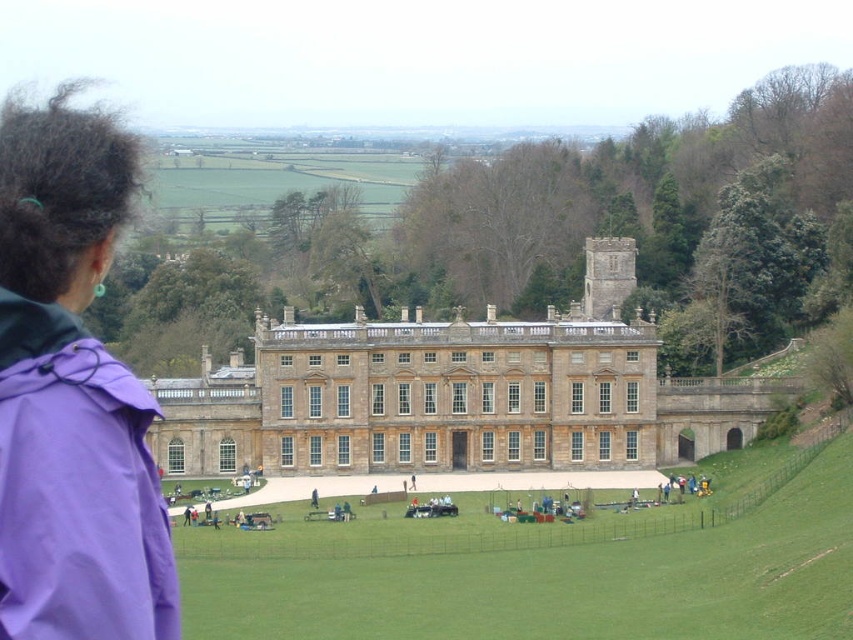
Between light brown stone palace at center and purple fabric at left, which one appears on the right side from the viewer's perspective?

From the viewer's perspective, light brown stone palace at center appears more on the right side.

Can you confirm if light brown stone palace at center is positioned above purple fabric at left?

Actually, light brown stone palace at center is below purple fabric at left.

Is point (364, 385) farther from viewer compared to point (39, 460)?

Yes, it is.

The height and width of the screenshot is (640, 853). I want to click on light brown stone palace at center, so click(x=456, y=394).